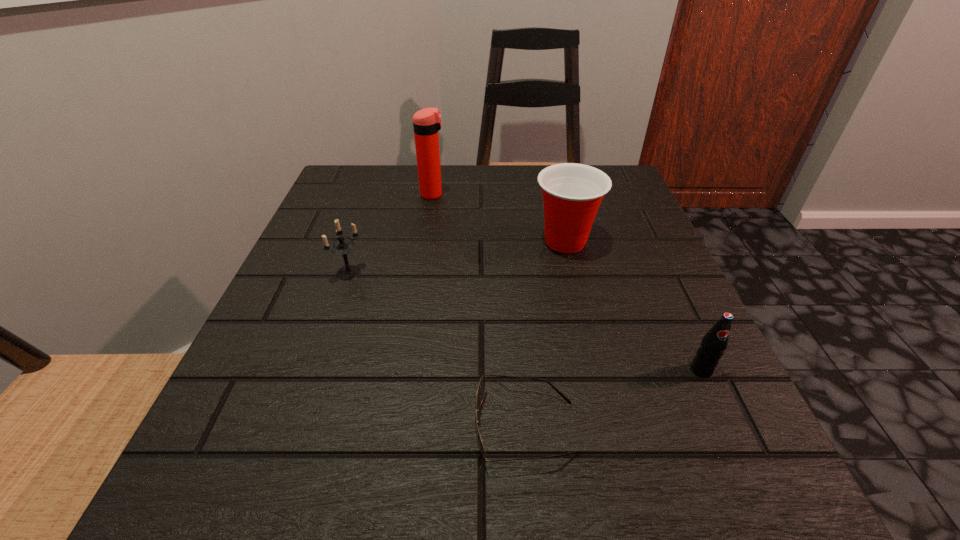
Locate an element on the screen. The image size is (960, 540). vacant space located on the right of the farthest object is located at coordinates (549, 194).

Where is `vacant region located 0.120m on the front of the fourth nearest object`? This screenshot has height=540, width=960. vacant region located 0.120m on the front of the fourth nearest object is located at coordinates (581, 307).

At what (x,y) coordinates should I click in order to perform the action: click on free region located on the front of the third farthest object. Please return your answer as a coordinate pair (x, y). The height and width of the screenshot is (540, 960). Looking at the image, I should click on (308, 392).

The height and width of the screenshot is (540, 960). I want to click on free space located 0.110m on the front label of the fourth farthest object, so click(739, 451).

The image size is (960, 540). I want to click on free space located on the front-facing side of the shortest object, so click(346, 427).

What are the coordinates of `free space located on the front-facing side of the shortest object` in the screenshot? It's located at (346, 427).

Locate an element on the screen. The image size is (960, 540). vacant space situated on the front-facing side of the shortest object is located at coordinates (330, 427).

Find the location of a particular element. object present at the far edge is located at coordinates (427, 122).

The image size is (960, 540). What are the coordinates of `object that is positioned at the near edge` in the screenshot? It's located at (481, 387).

This screenshot has height=540, width=960. Identify the location of object located in the left edge section of the desktop. (342, 247).